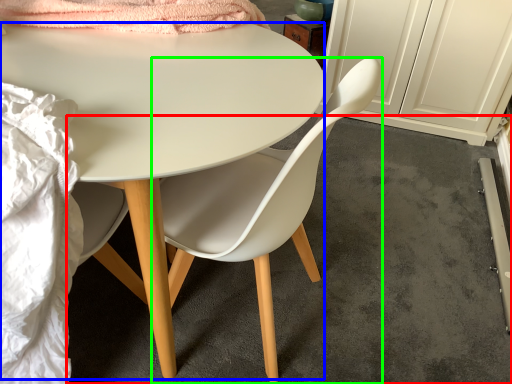
Question: Which object is the closest to the concrete (highlighted by a red box)? Choose among these: desk (highlighted by a blue box) or chair (highlighted by a green box).

Choices:
 (A) desk
 (B) chair

Answer: (B)